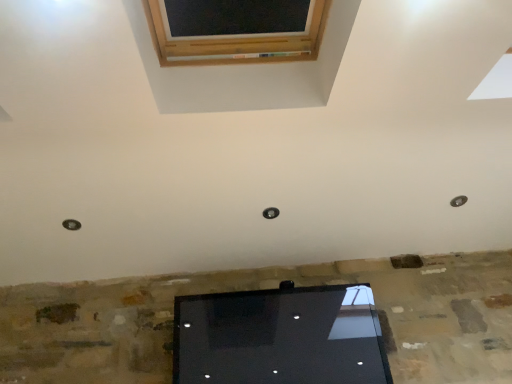
Question: Is metallic circular hole at right, the second hole ordered from the bottom, oriented away from metallic circular hole at lower left, marked as the 2th hole in a right-to-left arrangement?

Choices:
 (A) no
 (B) yes

Answer: (A)

Question: Can you confirm if metallic circular hole at right, the second hole ordered from the bottom, is wider than metallic circular hole at lower left, the second hole viewed from the top?

Choices:
 (A) yes
 (B) no

Answer: (B)

Question: Could you tell me if metallic circular hole at right, which is the 1th hole from right to left, is turned towards metallic circular hole at lower left, the 1th hole positioned from the bottom?

Choices:
 (A) yes
 (B) no

Answer: (B)

Question: Considering the relative positions of metallic circular hole at right, the 2th hole positioned from the left, and metallic circular hole at lower left, placed as the 1th hole when sorted from left to right, in the image provided, is metallic circular hole at right, the 2th hole positioned from the left, to the right of metallic circular hole at lower left, placed as the 1th hole when sorted from left to right, from the viewer's perspective?

Choices:
 (A) yes
 (B) no

Answer: (A)

Question: Does metallic circular hole at right, the 2th hole positioned from the left, have a greater height compared to metallic circular hole at lower left, the 1th hole positioned from the bottom?

Choices:
 (A) no
 (B) yes

Answer: (A)

Question: Is metallic circular hole at right, which is the 1th hole from right to left, directly adjacent to metallic circular hole at lower left, placed as the 1th hole when sorted from left to right?

Choices:
 (A) yes
 (B) no

Answer: (B)

Question: Is metallic circular hole at lower left, positioned as the 1th hole in front-to-back order, directly adjacent to metallic circular hole at right, the first hole viewed from the back?

Choices:
 (A) no
 (B) yes

Answer: (A)

Question: Would you consider metallic circular hole at lower left, positioned as the 1th hole in front-to-back order, to be distant from metallic circular hole at right, the second hole ordered from the bottom?

Choices:
 (A) no
 (B) yes

Answer: (B)

Question: Does metallic circular hole at lower left, marked as the 2th hole in a right-to-left arrangement, have a larger size compared to metallic circular hole at right, the 2th hole positioned from the left?

Choices:
 (A) yes
 (B) no

Answer: (A)

Question: Does metallic circular hole at lower left, which appears as the second hole when viewed from the back, have a lesser height compared to metallic circular hole at right, which is the 1th hole from right to left?

Choices:
 (A) no
 (B) yes

Answer: (A)

Question: Can you confirm if metallic circular hole at lower left, positioned as the 1th hole in front-to-back order, is wider than metallic circular hole at right, the first hole viewed from the back?

Choices:
 (A) yes
 (B) no

Answer: (A)

Question: From a real-world perspective, does metallic circular hole at lower left, positioned as the 1th hole in front-to-back order, stand above metallic circular hole at right, the first hole viewed from the back?

Choices:
 (A) yes
 (B) no

Answer: (A)

Question: Is metallic circular hole at lower left, placed as the 1th hole when sorted from left to right, spatially inside metallic circular hole at right, the first hole viewed from the back, or outside of it?

Choices:
 (A) inside
 (B) outside

Answer: (B)